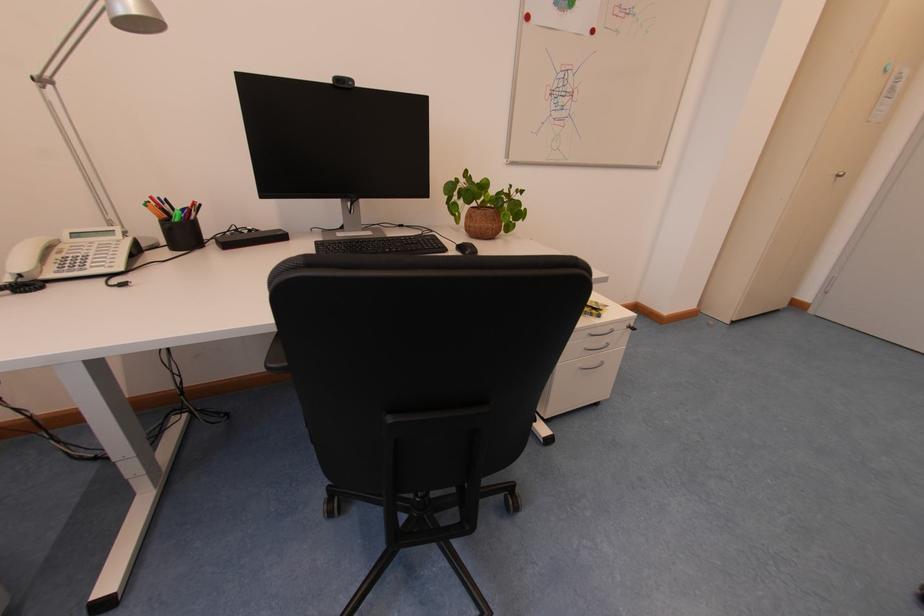
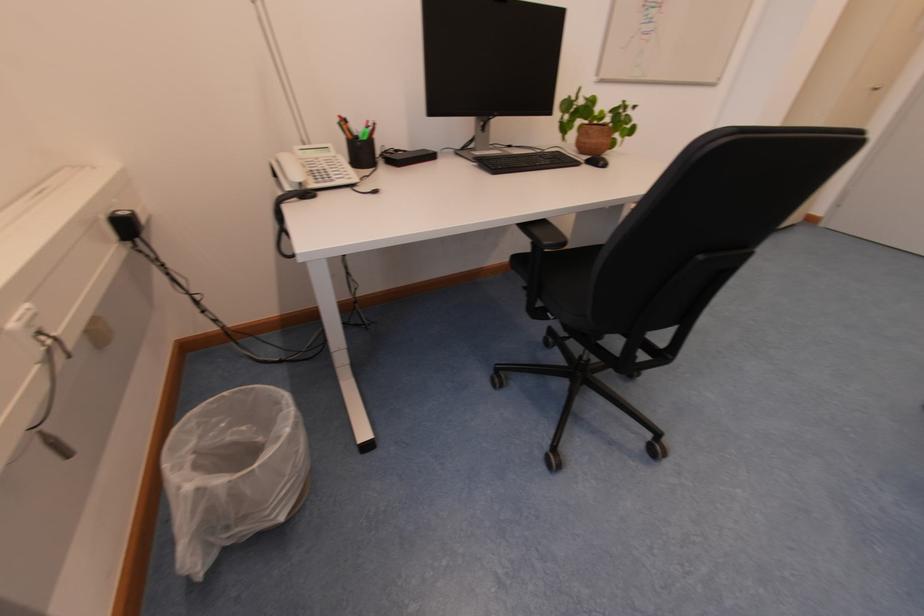
In the second image, find the point that corresponds to (152,208) in the first image.

(347, 127)